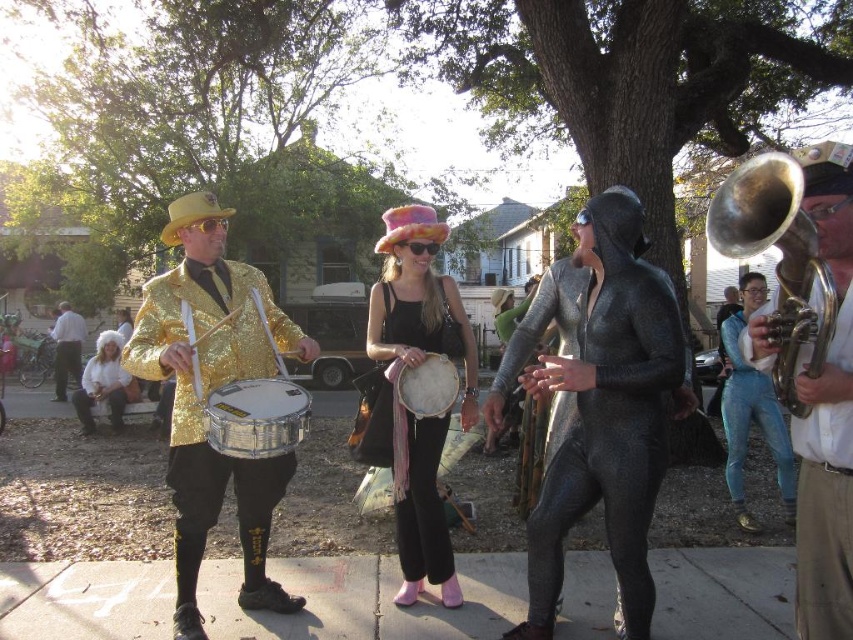
Question: Is concrete at center below gold sequined jacket at left?

Choices:
 (A) yes
 (B) no

Answer: (A)

Question: Estimate the real-world distances between objects in this image. Which object is farther from the white fluffy wig at center?

Choices:
 (A) shiny silver trumpet at right
 (B) brass trumpet at upper right

Answer: (A)

Question: Is shiny silver trumpet at right bigger than brass trumpet at upper right?

Choices:
 (A) yes
 (B) no

Answer: (A)

Question: Considering the real-world distances, which object is closest to the white fluffy wig at center?

Choices:
 (A) multicolored felt hat at center
 (B) brass trumpet at upper right
 (C) shiny silver trumpet at right

Answer: (A)

Question: Does blue metallic jumpsuit at center appear over white fluffy wig at center?

Choices:
 (A) no
 (B) yes

Answer: (A)

Question: Considering the real-world distances, which object is farthest from the shiny metallic suit at center?

Choices:
 (A) brass trumpet at upper right
 (B) blue metallic jumpsuit at center

Answer: (B)